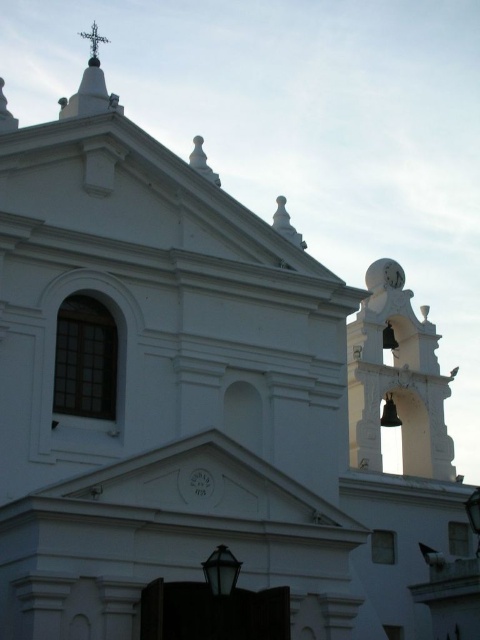
You are standing in front of the church and want to place a new flowerpot between the white metallic bell tower at upper right and the metallic clock at upper right. Is this possible based on their positions?

The white metallic bell tower at upper right is positioned under the metallic clock at upper right, so there is no horizontal space between them to place a flowerpot.

You are an architect designing a model of this church. You need to ensure the white metallic bell tower at upper right and the metallic clock at upper right are scaled correctly. Which object should be larger in your model?

The white metallic bell tower at upper right should be larger in the model since it is bigger than the metallic clock at upper right according to the description.